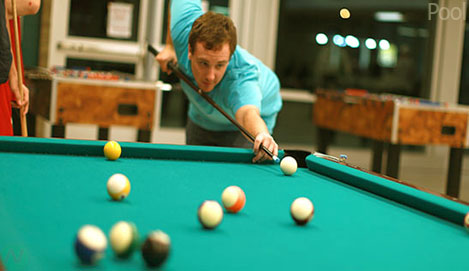
This screenshot has height=271, width=469. I want to click on pool table, so click(x=208, y=187).